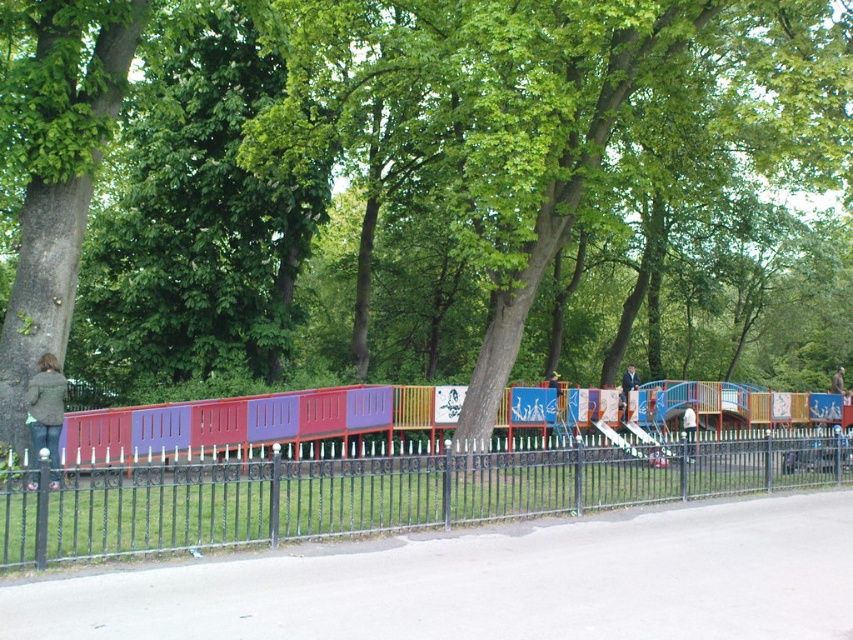
Is multicolored wooden train at center wider than white fabric jacket at center?

Yes, multicolored wooden train at center is wider than white fabric jacket at center.

Is multicolored wooden train at center bigger than white fabric jacket at center?

Yes, multicolored wooden train at center is bigger than white fabric jacket at center.

Is point (390, 412) more distant than point (688, 416)?

No, it is not.

You are a GUI agent. You are given a task and a screenshot of the screen. Output one action in this format:
    pyautogui.click(x=<x>, y=<y>)
    Task: Click on the multicolored wooden train at center
    The width and height of the screenshot is (853, 640).
    Given the screenshot: What is the action you would take?
    pyautogui.click(x=257, y=426)

Is white plastic slide at center to the right of white fabric jacket at center from the viewer's perspective?

Correct, you'll find white plastic slide at center to the right of white fabric jacket at center.

Can you confirm if white plastic slide at center is positioned below white fabric jacket at center?

No.

Is point (659, 388) behind point (688, 410)?

Yes, point (659, 388) is farther from viewer.

Identify the location of white plastic slide at center. (659, 410).

Which of these two, green leafy tree at center or blue plastic slide at center, stands shorter?

blue plastic slide at center

Is green leafy tree at center positioned behind blue plastic slide at center?

That is False.

Measure the distance between point [589,44] and camera.

Point [589,44] and camera are 15.00 meters apart from each other.

Locate an element on the screen. The width and height of the screenshot is (853, 640). green leafy tree at center is located at coordinates (434, 195).